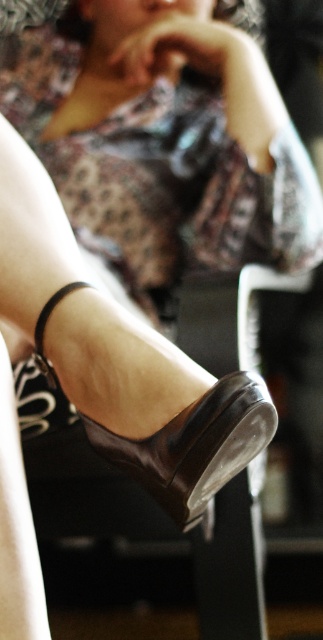
In the scene shown: Is matte floral dress at center positioned in front of shiny brown sandal at lower center?

That is False.

Is point (271, 209) behind point (179, 432)?

Yes, it is behind point (179, 432).

Find the location of a particular element. The height and width of the screenshot is (640, 323). matte floral dress at center is located at coordinates (164, 177).